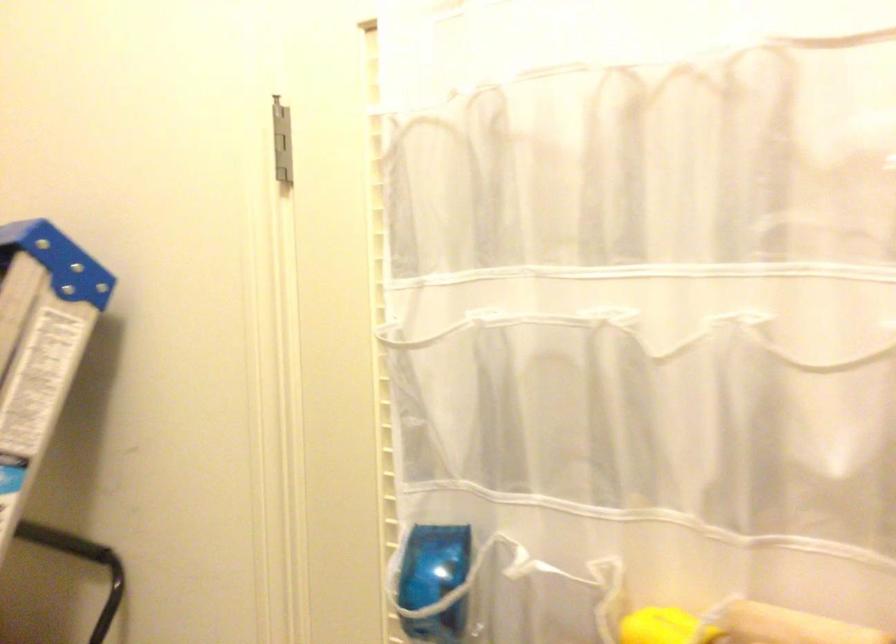
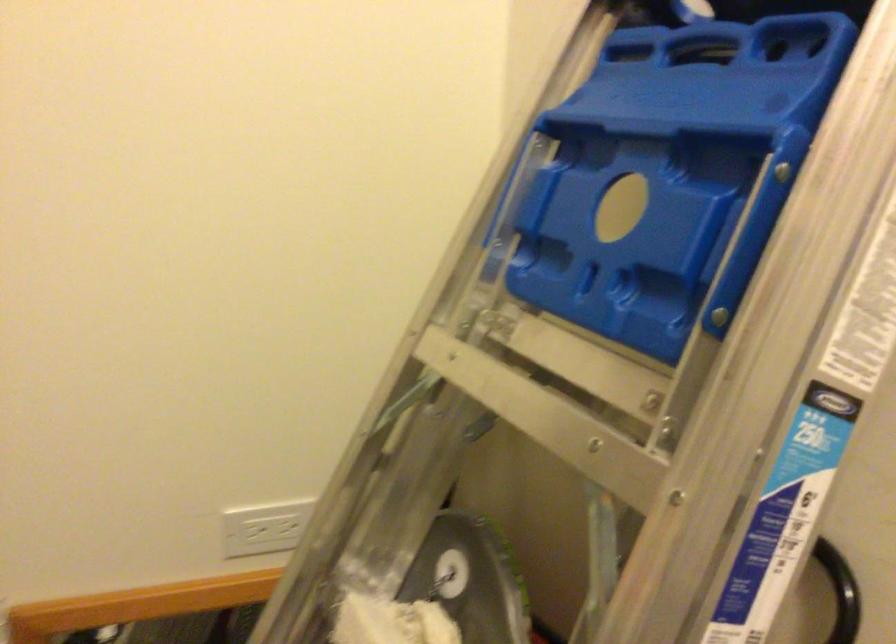
Question: I am providing you with two images of the same scene from different viewpoints. Please identify which objects are invisible in image2.

Choices:
 (A) black ladder handle
 (B) white wall outlet
 (C) bottle on shelf
 (D) blue ladder handle

Answer: (A)